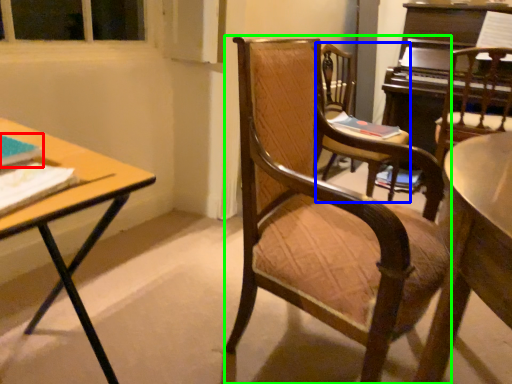
Question: Based on their relative distances, which object is farther from book (highlighted by a red box)? Choose from chair (highlighted by a blue box) and chair (highlighted by a green box).

Choices:
 (A) chair
 (B) chair

Answer: (A)